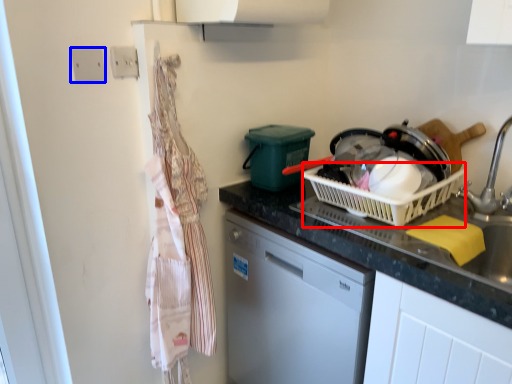
Question: Which object appears farthest to the camera in this image, basket (highlighted by a red box) or electric outlet (highlighted by a blue box)?

Choices:
 (A) basket
 (B) electric outlet

Answer: (B)